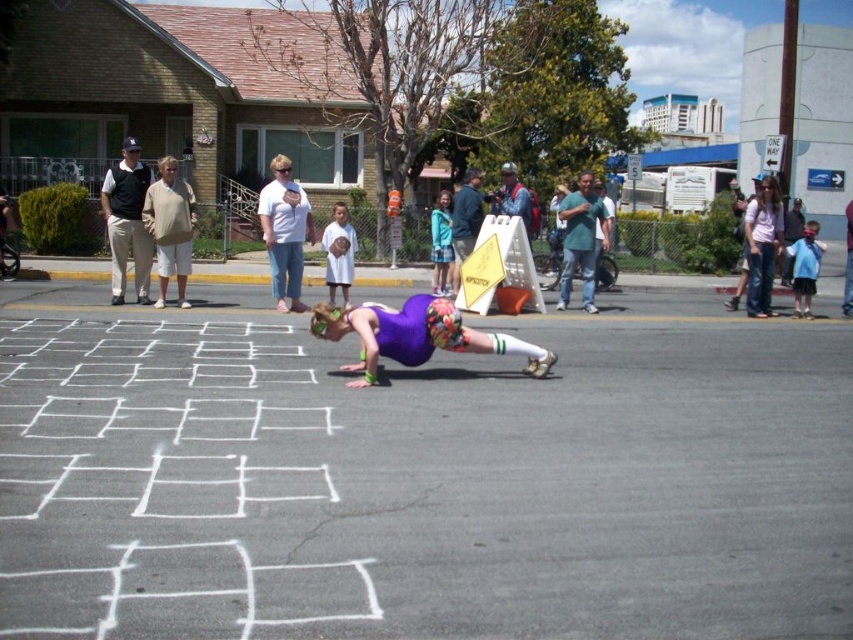
You are designing a hopscotch game and need to decide where to place the starting square. Given the scene, which object should the starting square be placed near, the black asphalt at center or the matte khaki pants at left, and why?

The starting square should be placed near the black asphalt at center because it has a larger size compared to the matte khaki pants at left, providing enough space for the game.